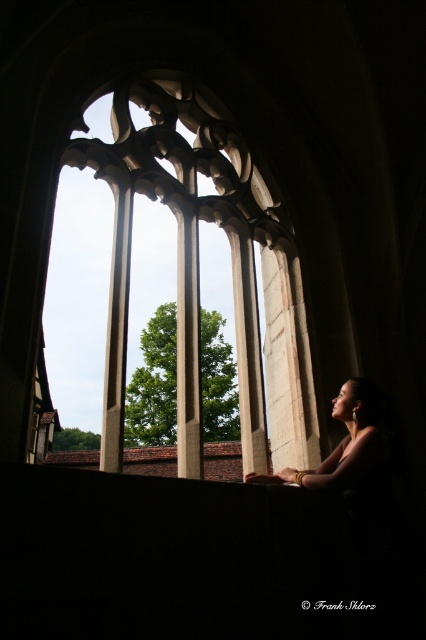
Does white stone window at center appear on the left side of smooth skin woman at center?

Yes, white stone window at center is to the left of smooth skin woman at center.

Is white stone window at center shorter than smooth skin woman at center?

No, white stone window at center is not shorter than smooth skin woman at center.

From the picture: Measure the distance between white stone window at center and camera.

They are 17.61 meters apart.

You are a GUI agent. You are given a task and a screenshot of the screen. Output one action in this format:
    pyautogui.click(x=<x>, y=<y>)
    Task: Click on the white stone window at center
    
    Given the screenshot: What is the action you would take?
    pyautogui.click(x=198, y=262)